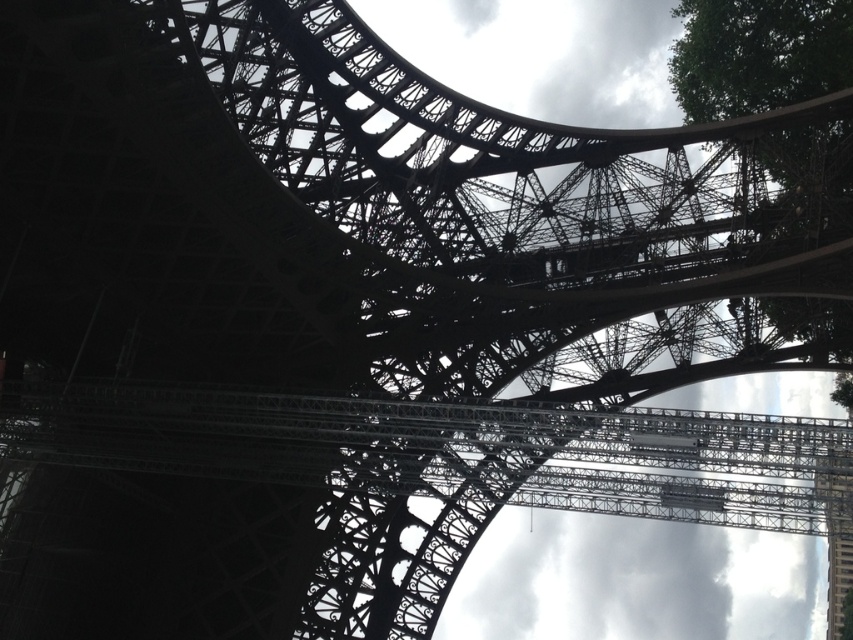
Question: Which of the following is the farthest from the observer?

Choices:
 (A) green leafy tree at upper right
 (B) metallic lattice tower at right

Answer: (A)

Question: Does green leafy tree at upper right appear on the right side of metallic lattice tower at right?

Choices:
 (A) yes
 (B) no

Answer: (B)

Question: Can you confirm if green leafy tree at upper right is smaller than metallic lattice tower at right?

Choices:
 (A) yes
 (B) no

Answer: (B)

Question: Which point appears closest to the camera in this image?

Choices:
 (A) (752, 109)
 (B) (845, 509)

Answer: (B)

Question: Does green leafy tree at upper right appear under metallic lattice tower at right?

Choices:
 (A) no
 (B) yes

Answer: (A)